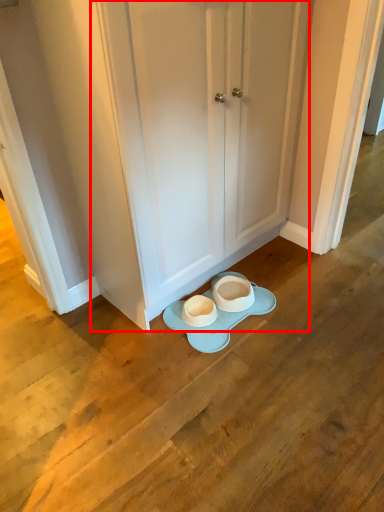
Question: From the image's perspective, where is door (annotated by the red box) located in relation to porcelain in the image?

Choices:
 (A) below
 (B) above

Answer: (B)